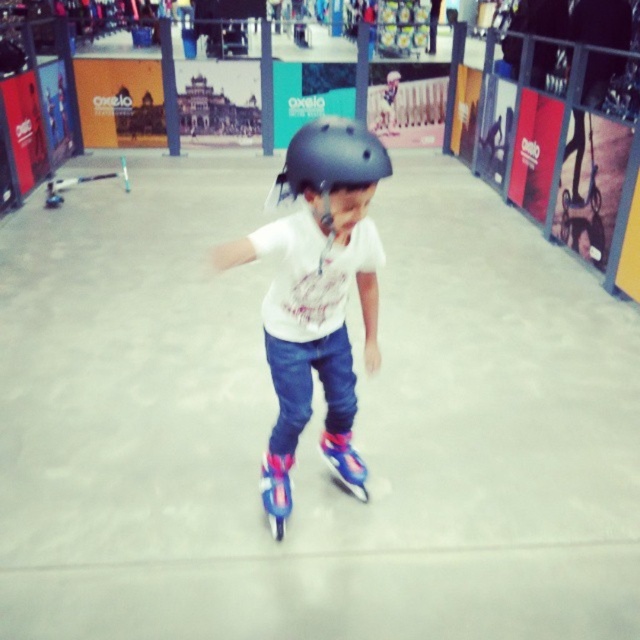
You are a safety inspector checking the placement of safety equipment in the rollerblading area. The safety equipment must be placed within a 0.5 meter radius of the pink plastic roller skate at center. Where should you place the safety equipment?

The safety equipment should be placed within a 0.5 meter radius of the pink plastic roller skate at center, which is located at point (276, 492).

You are a safety inspector checking the rollerblading area. You see the matte black helmet at center and the pink plastic roller skate at center. Which object is positioned more to the right side?

The matte black helmet at center is positioned to the right of the pink plastic roller skate at center, so the matte black helmet at center is more to the right side.

You are a safety inspector checking the rollerblading facility. You notice a point at coordinates (276, 492) on the floor. What object is located at that point?

The point at coordinates (276, 492) corresponds to the pink plastic roller skate at center.